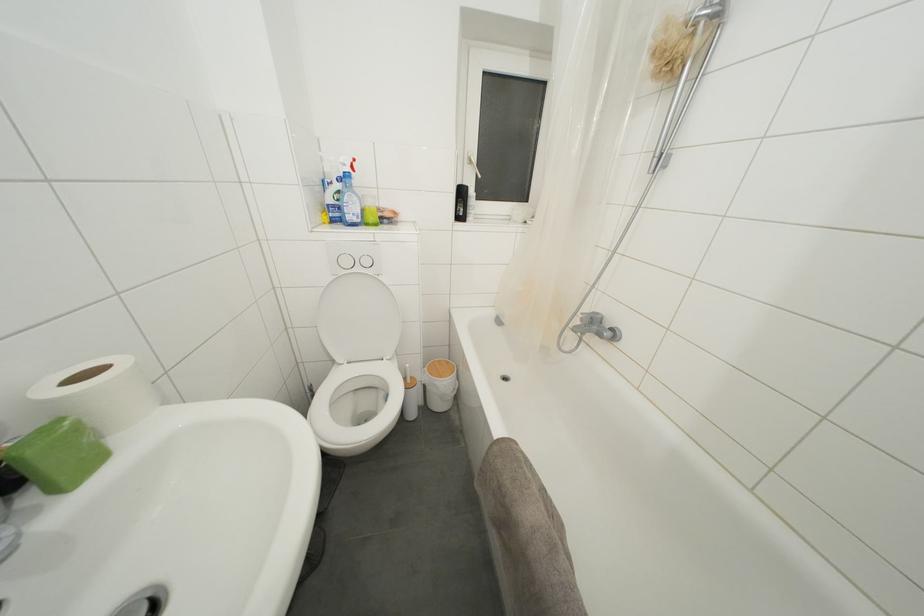
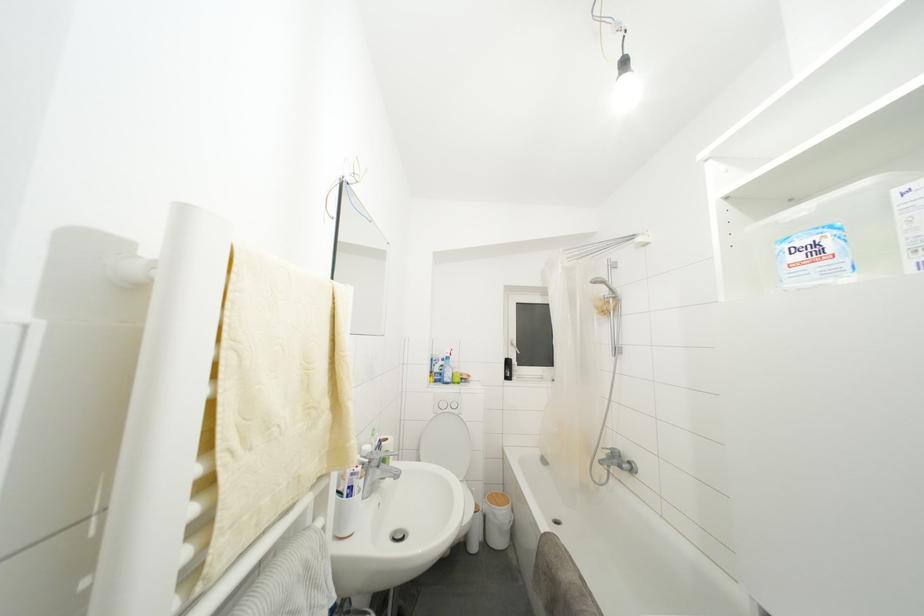
Question: Based on the continuous images, in which direction is the camera rotating? Reply with the corresponding letter.

Choices:
 (A) Left
 (B) Right
 (C) Up
 (D) Down

Answer: (C)